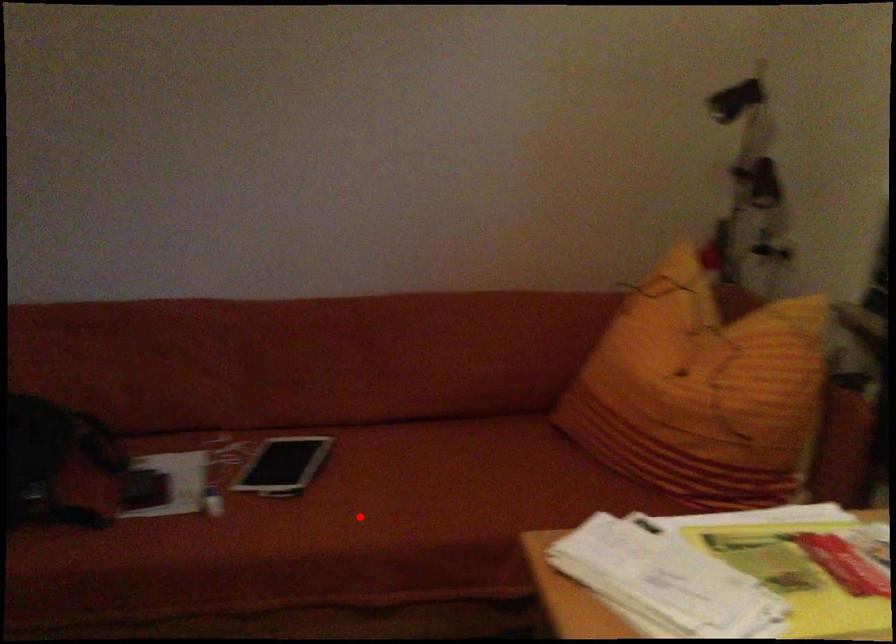
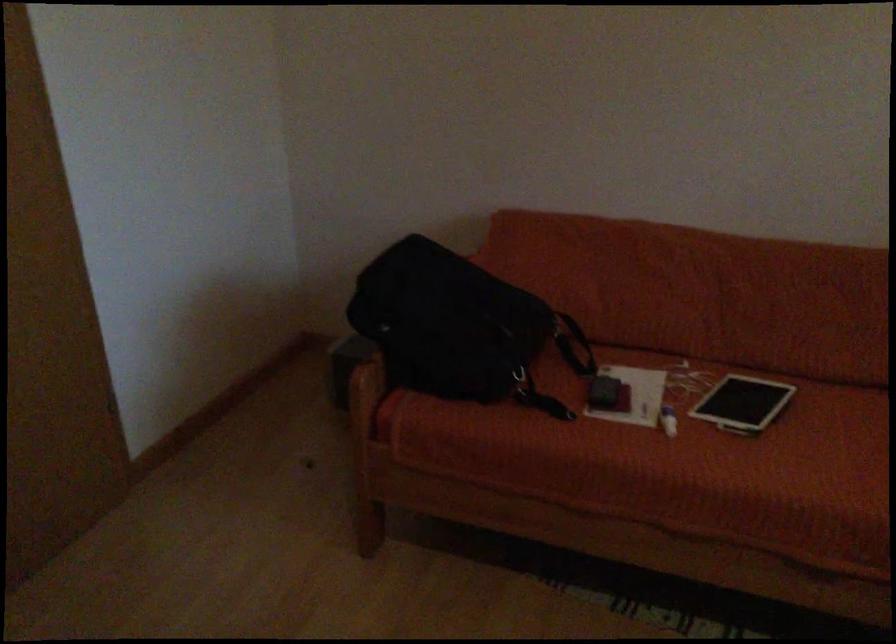
Locate, in the second image, the point that corresponds to the highlighted location in the first image.

(823, 471)